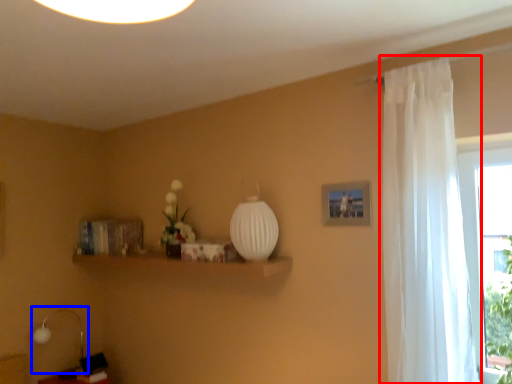
Question: Which point is further to the camera, curtain (highlighted by a red box) or table lamp (highlighted by a blue box)?

Choices:
 (A) curtain
 (B) table lamp

Answer: (B)